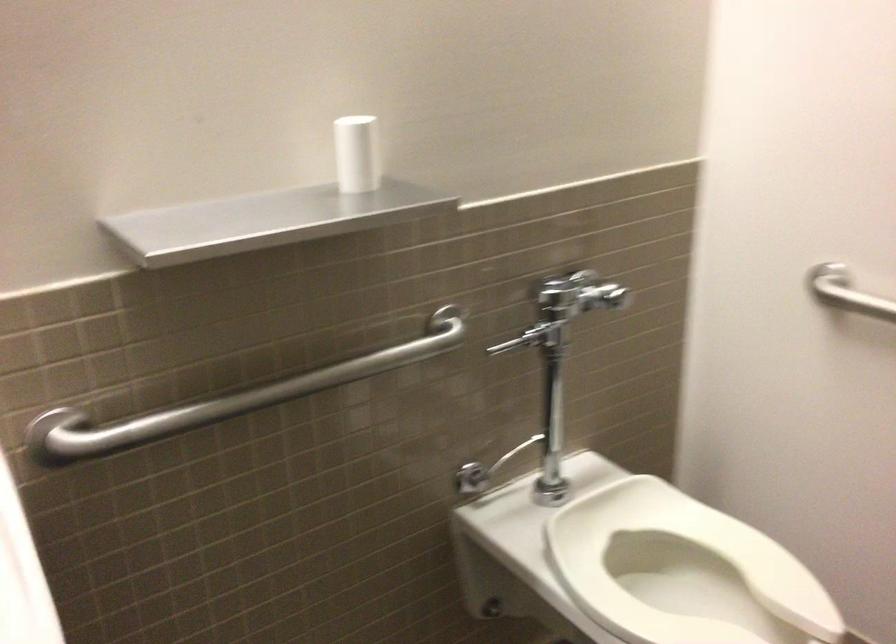
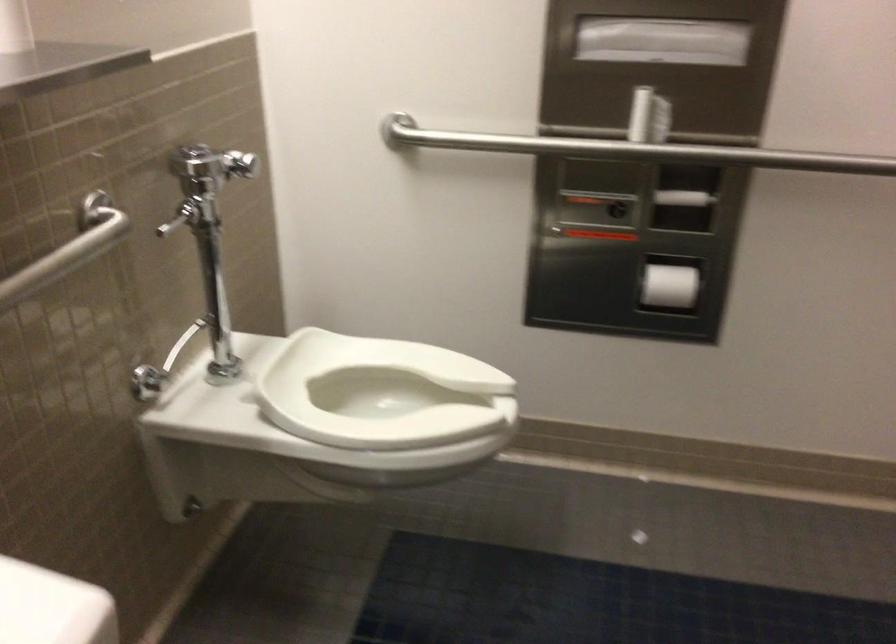
Find the pixel in the second image that matches [375,355] in the first image.

(67, 250)